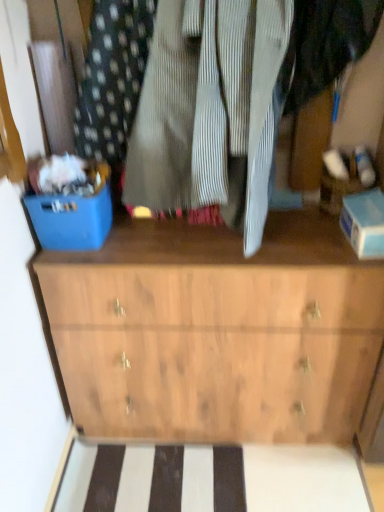
Question: Considering their positions, is blue plastic bin at left located in front of or behind wooden chest of drawers at center?

Choices:
 (A) front
 (B) behind

Answer: (A)

Question: Do you think blue plastic bin at left is within wooden chest of drawers at center, or outside of it?

Choices:
 (A) outside
 (B) inside

Answer: (A)

Question: In terms of width, does blue plastic bin at left look wider or thinner when compared to wooden chest of drawers at center?

Choices:
 (A) thin
 (B) wide

Answer: (A)

Question: From the image's perspective, relative to blue plastic bin at left, is wooden chest of drawers at center above or below?

Choices:
 (A) below
 (B) above

Answer: (A)

Question: Is wooden chest of drawers at center inside the boundaries of blue plastic bin at left, or outside?

Choices:
 (A) outside
 (B) inside

Answer: (A)

Question: Considering the relative positions of wooden chest of drawers at center and blue plastic bin at left in the image provided, is wooden chest of drawers at center to the left or to the right of blue plastic bin at left?

Choices:
 (A) left
 (B) right

Answer: (B)

Question: Looking at their shapes, would you say wooden chest of drawers at center is wider or thinner than blue plastic bin at left?

Choices:
 (A) wide
 (B) thin

Answer: (A)